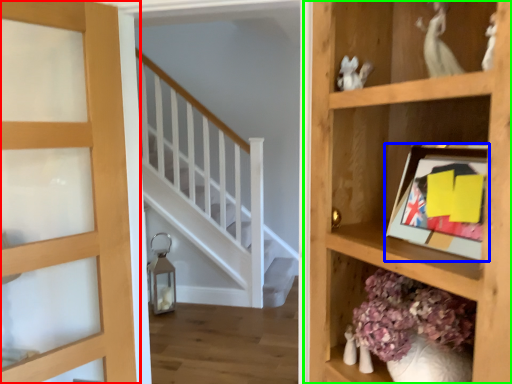
Question: Estimate the real-world distances between objects in this image. Which object is closer to door (highlighted by a red box), picture frame (highlighted by a blue box) or shelf (highlighted by a green box)?

Choices:
 (A) picture frame
 (B) shelf

Answer: (B)